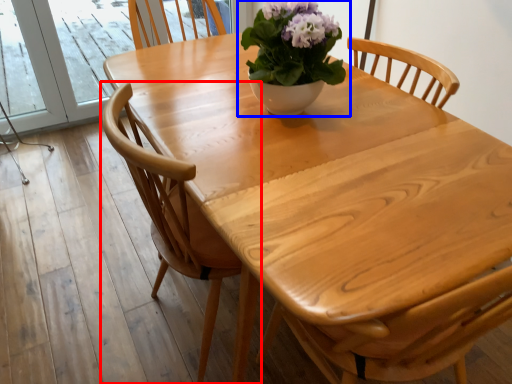
Question: Which point is closer to the camera, chair (highlighted by a red box) or houseplant (highlighted by a blue box)?

Choices:
 (A) chair
 (B) houseplant

Answer: (A)